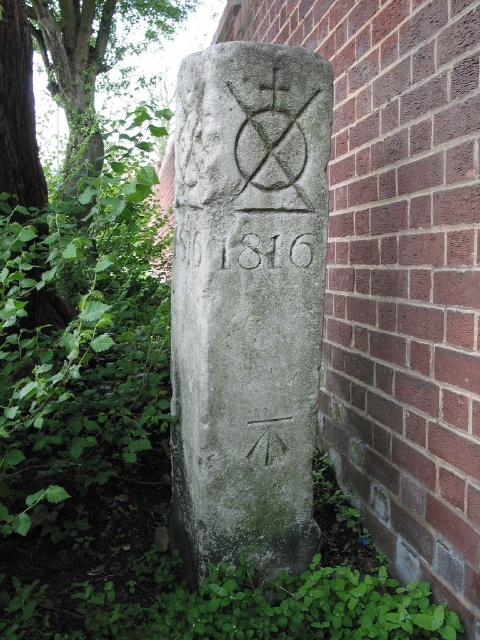
Question: Which is farther from the gray stone gravestone at center?

Choices:
 (A) green leafy weed at left
 (B) green leafy tree at left
 (C) gray stone inscription at center

Answer: (B)

Question: Does green leafy tree at left appear on the right side of gray stone inscription at center?

Choices:
 (A) no
 (B) yes

Answer: (A)

Question: Can you confirm if green leafy weed at left is wider than gray stone inscription at center?

Choices:
 (A) no
 (B) yes

Answer: (B)

Question: Based on their relative distances, which object is nearer to the green leafy tree at left?

Choices:
 (A) green leafy weed at left
 (B) gray stone inscription at center

Answer: (A)

Question: From the image, what is the correct spatial relationship of gray stone gravestone at center in relation to green leafy tree at left?

Choices:
 (A) right
 (B) left

Answer: (A)

Question: Which point is closer to the camera?

Choices:
 (A) (309, 262)
 (B) (153, 36)
 (C) (204, 266)

Answer: (C)